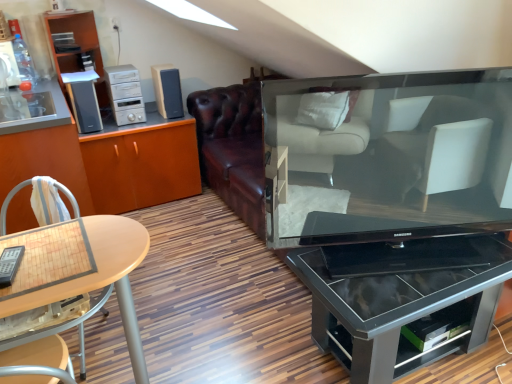
You are a GUI agent. You are given a task and a screenshot of the screen. Output one action in this format:
    pyautogui.click(x=<x>, y=<y>)
    Task: Click on the vacant area on top of wooden light brown chair at lower left (from a real-world perspective)
    
    Given the screenshot: What is the action you would take?
    pyautogui.click(x=27, y=283)